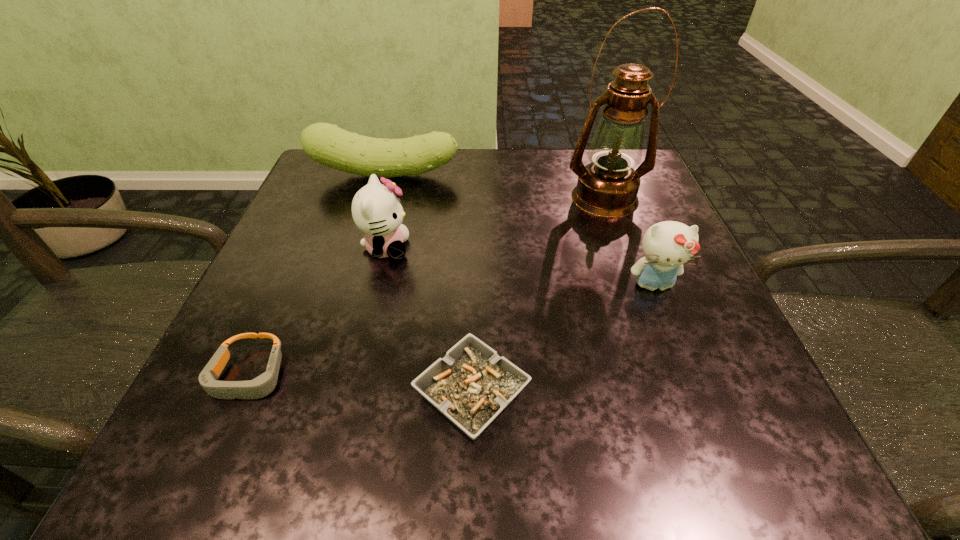
Identify the location of object that is at the far left corner. (327, 144).

You are a GUI agent. You are given a task and a screenshot of the screen. Output one action in this format:
    pyautogui.click(x=<x>, y=<y>)
    Task: Click on the object at the near left corner
    
    Given the screenshot: What is the action you would take?
    pyautogui.click(x=261, y=386)

At what (x,y) coordinates should I click in order to perform the action: click on object situated at the far right corner. Please return your answer as a coordinate pair (x, y). The image size is (960, 540). Looking at the image, I should click on (607, 187).

Find the location of a particular element. free space at the far edge of the desktop is located at coordinates (565, 192).

Locate an element on the screen. The width and height of the screenshot is (960, 540). vacant region at the near edge of the desktop is located at coordinates (325, 443).

At what (x,y) coordinates should I click in order to perform the action: click on free space at the left edge of the desktop. Please return your answer as a coordinate pair (x, y). This screenshot has height=540, width=960. Looking at the image, I should click on (323, 271).

Locate an element on the screen. The image size is (960, 540). free region at the right edge of the desktop is located at coordinates (656, 319).

The image size is (960, 540). Identify the location of vacant space at the far left corner of the desktop. (349, 198).

The image size is (960, 540). I want to click on free space at the near left corner of the desktop, so pos(268,450).

In the image, there is a desktop. Find the location of `free space at the near right corner`. free space at the near right corner is located at coordinates (767, 449).